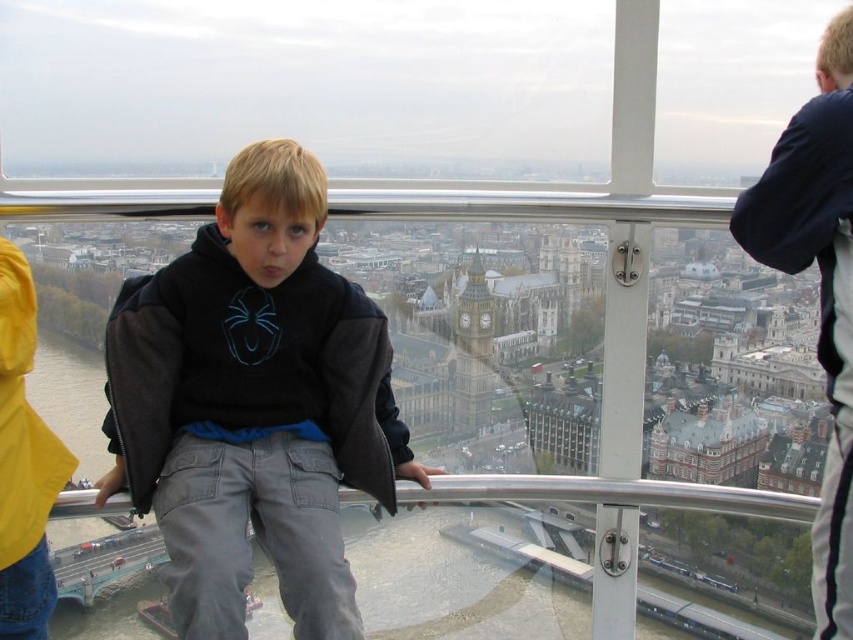
Which is below, dark gray hoodie at center or matte gray clock tower at center?

matte gray clock tower at center is lower down.

Can you confirm if dark gray hoodie at center is positioned to the left of matte gray clock tower at center?

Yes, dark gray hoodie at center is to the left of matte gray clock tower at center.

Between point (271, 189) and point (457, 419), which one is positioned in front?

Point (271, 189) is more forward.

At what (x,y) coordinates should I click in order to perform the action: click on dark gray hoodie at center. Please return your answer as a coordinate pair (x, y). Looking at the image, I should click on (254, 403).